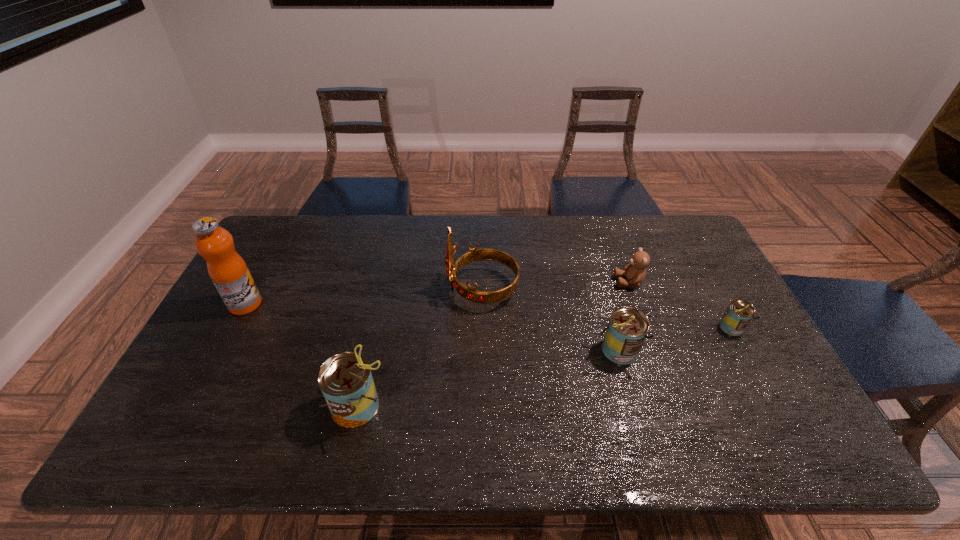
The width and height of the screenshot is (960, 540). I want to click on object at the near edge, so click(x=345, y=379).

At what (x,y) coordinates should I click in order to perform the action: click on object present at the left edge. Please return your answer as a coordinate pair (x, y). Image resolution: width=960 pixels, height=540 pixels. Looking at the image, I should click on (227, 269).

Locate an element on the screen. object that is at the right edge is located at coordinates (738, 314).

Identify the location of vacant space at the far edge. This screenshot has height=540, width=960. (604, 247).

The width and height of the screenshot is (960, 540). In the image, there is a desktop. What are the coordinates of `vacant space at the near edge` in the screenshot? It's located at point(612,413).

The height and width of the screenshot is (540, 960). I want to click on vacant area at the left edge of the desktop, so click(265, 264).

Image resolution: width=960 pixels, height=540 pixels. In the image, there is a desktop. Find the location of `free space at the far left corner`. free space at the far left corner is located at coordinates (296, 233).

Where is `vacant space at the far right corner of the desktop`? vacant space at the far right corner of the desktop is located at coordinates (653, 238).

This screenshot has height=540, width=960. In order to click on empty space that is in between the tiara and the teddy bear in this screenshot , I will do `click(556, 286)`.

At what (x,y) coordinates should I click in order to perform the action: click on free space between the second can from right to left and the leftmost can. Please return your answer as a coordinate pair (x, y). The height and width of the screenshot is (540, 960). Looking at the image, I should click on (489, 378).